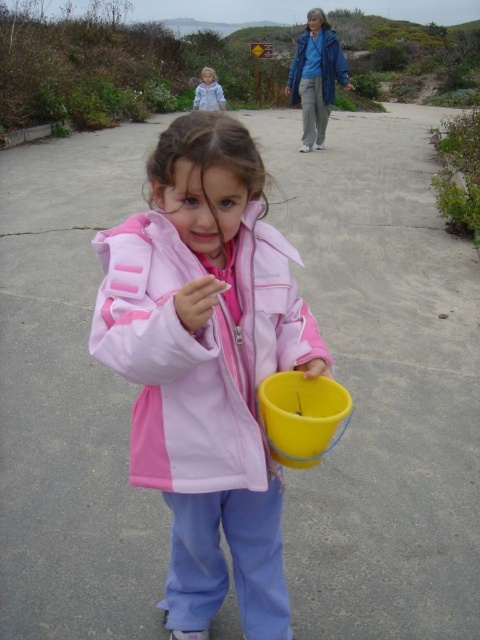
You are the child holding the yellow bucket. You see the blue smooth jacket at upper center and the light blue denim jacket at upper center. Which adult is closer to your right side?

The blue smooth jacket at upper center is to the right of the light blue denim jacket at upper center, so the adult wearing the blue smooth jacket at upper center is closer to your right side.

You are the child holding the yellow bucket. You notice two adults wearing jackets in the upper center of your view. Which jacket, the blue smooth jacket at upper center or the light blue denim jacket at upper center, is wider?

The blue smooth jacket at upper center might be wider than the light blue denim jacket at upper center.